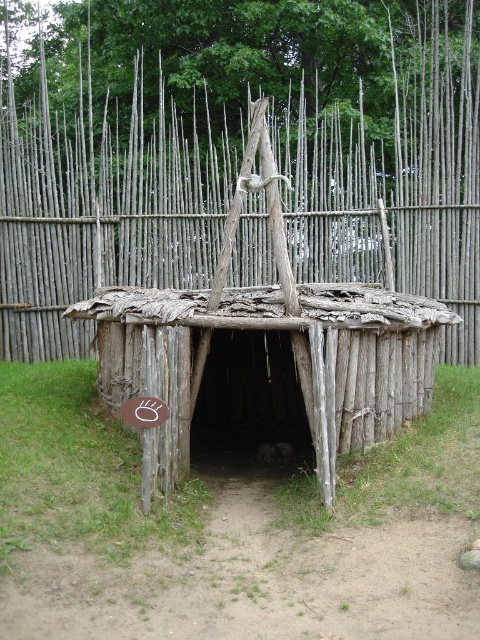
You are an architect designing a new outdoor exhibit and want to place a sign in front of the weathered wood hut at center. The sign must be placed so that it is visible from the entrance but not blocked by the gray wooden fence at center. Based on the scene description, where should you position the sign?

The gray wooden fence at center is much taller than the weathered wood hut at center. To ensure visibility from the entrance, the sign should be placed in front of the weathered wood hut at center but below the height of the gray wooden fence at center so it remains visible over the hut but not blocked by the fence.